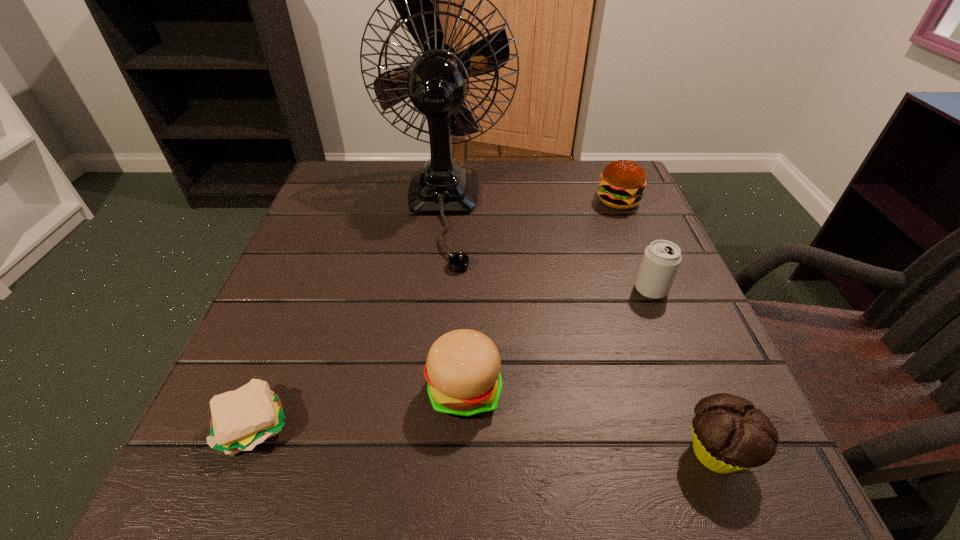
Identify the location of hamburger that is positioned at the right edge. The image size is (960, 540). (622, 182).

You are a GUI agent. You are given a task and a screenshot of the screen. Output one action in this format:
    pyautogui.click(x=<x>, y=<y>)
    Task: Click on the muffin present at the right edge
    This screenshot has width=960, height=540.
    Given the screenshot: What is the action you would take?
    pyautogui.click(x=729, y=434)

Image resolution: width=960 pixels, height=540 pixels. Identify the location of object present at the far left corner. pos(437,81).

Where is `object that is positioned at the near left corner`? object that is positioned at the near left corner is located at coordinates (241, 419).

You are a GUI agent. You are given a task and a screenshot of the screen. Output one action in this format:
    pyautogui.click(x=<x>, y=<y>)
    Task: Click on the object that is at the far right corner
    This screenshot has width=960, height=540.
    Given the screenshot: What is the action you would take?
    pyautogui.click(x=622, y=182)

Locate an element on the screen. The width and height of the screenshot is (960, 540). object that is at the near right corner is located at coordinates (729, 434).

In the image, there is a desktop. At what (x,y) coordinates should I click in order to perform the action: click on vacant space at the far edge. Please return your answer as a coordinate pair (x, y). Looking at the image, I should click on tap(529, 187).

The image size is (960, 540). What are the coordinates of `vacant space at the near edge of the desktop` in the screenshot? It's located at (406, 482).

Image resolution: width=960 pixels, height=540 pixels. I want to click on vacant space at the left edge of the desktop, so click(314, 251).

Where is `vacant space at the right edge of the desktop`? This screenshot has height=540, width=960. vacant space at the right edge of the desktop is located at coordinates (628, 281).